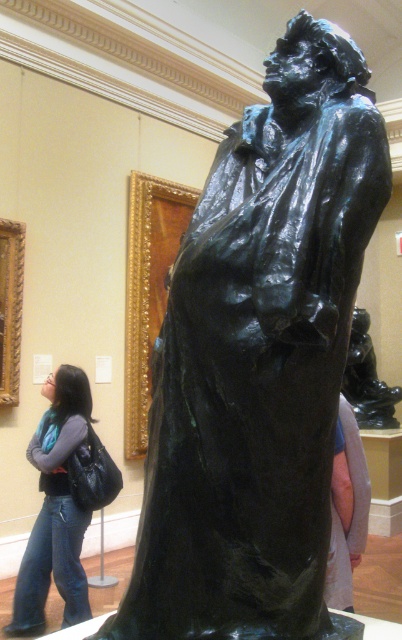
Is denim jeans at lower left closer to camera compared to shiny bronze statue at center?

Yes, it is.

This screenshot has height=640, width=402. Identify the location of denim jeans at lower left. [55, 508].

Who is more forward, (75, 609) or (354, 348)?

Point (75, 609) is in front.

The image size is (402, 640). In order to click on denim jeans at lower left in this screenshot , I will do `click(55, 508)`.